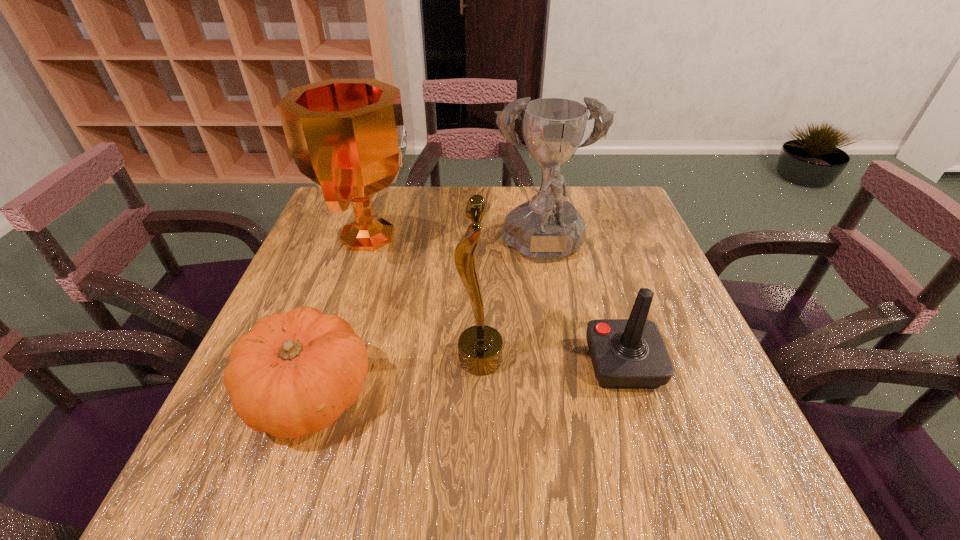
This screenshot has width=960, height=540. Find the location of `object positioned at the near edge`. object positioned at the near edge is located at coordinates (294, 373).

In order to click on award that is at the left edge in this screenshot , I will do `click(347, 136)`.

I want to click on pumpkin that is positioned at the left edge, so click(x=294, y=373).

Locate an element on the screen. award located at the right edge is located at coordinates (545, 229).

Where is `joystick that is at the right edge`? The width and height of the screenshot is (960, 540). joystick that is at the right edge is located at coordinates (630, 353).

The image size is (960, 540). What are the coordinates of `object that is at the far left corner` in the screenshot? It's located at (347, 136).

The image size is (960, 540). What are the coordinates of `object at the near left corner` in the screenshot? It's located at (294, 373).

This screenshot has height=540, width=960. I want to click on object that is at the far right corner, so click(x=545, y=229).

Where is `free location at the far edge of the desktop`? This screenshot has height=540, width=960. free location at the far edge of the desktop is located at coordinates (397, 204).

Locate an element on the screen. vacant area at the near edge of the desktop is located at coordinates (319, 469).